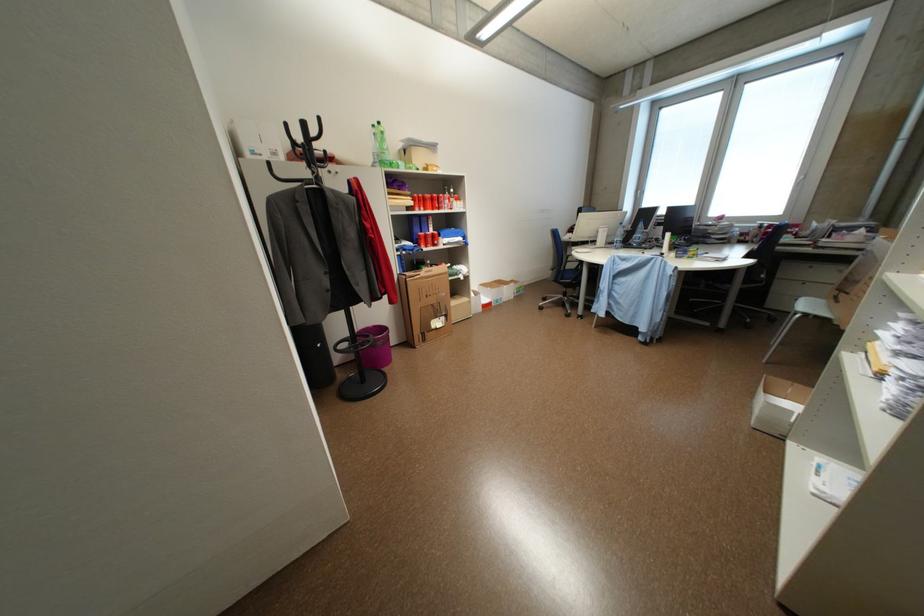
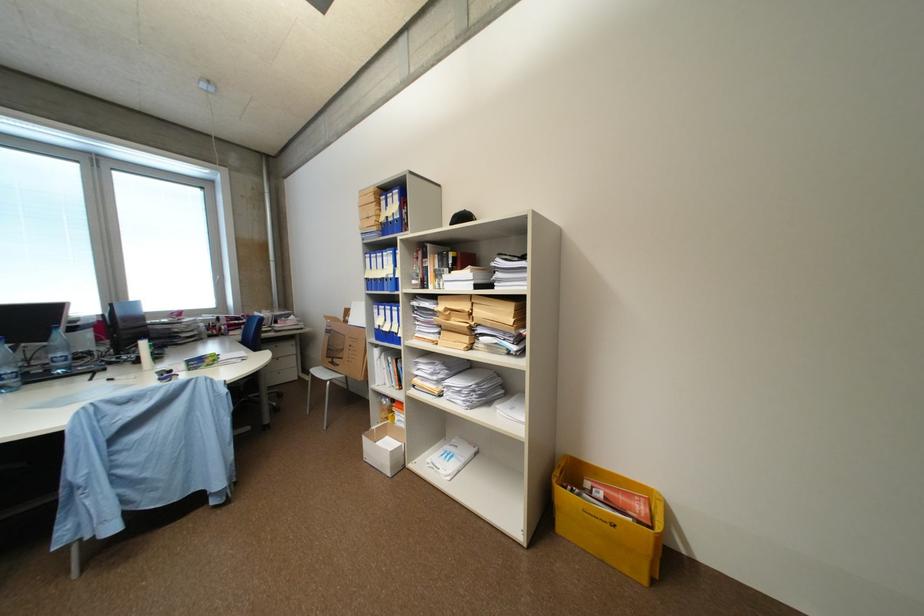
Question: The first image is from the beginning of the video and the second image is from the end. How did the camera likely rotate when shooting the video?

Choices:
 (A) Left
 (B) Right
 (C) Up
 (D) Down

Answer: (B)